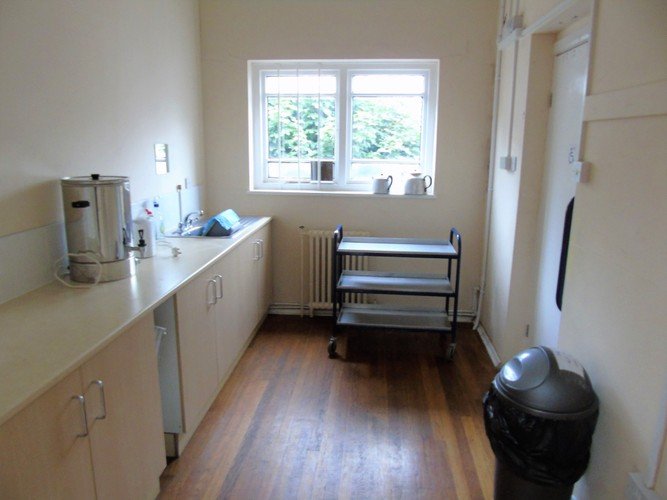
The height and width of the screenshot is (500, 667). I want to click on radiator, so click(325, 254), click(321, 285), click(360, 260), click(356, 296).